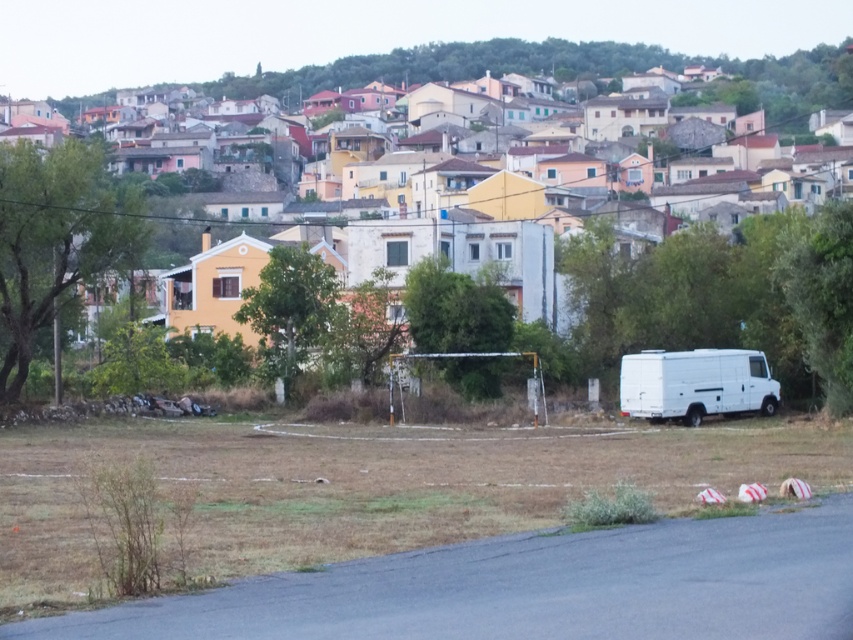
You are a delivery person trying to park your white matte van at center near the white matte van at right. Since both are in the open grassy field, which van is closer to the edge of the field?

The white matte van at right is closer to the edge of the field because the white matte van at center is closer to the viewer, meaning the van at right is further away and thus nearer to the edge.